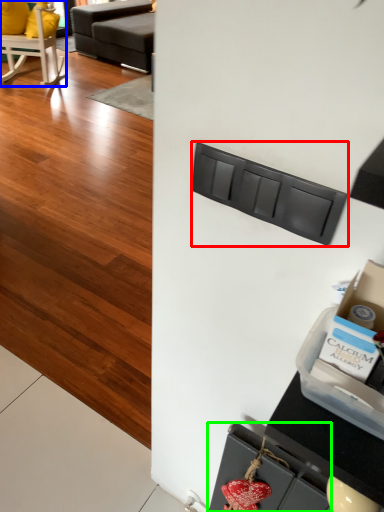
Question: Estimate the real-world distances between objects in this image. Which object is farther from drawer (highlighted by a red box), chair (highlighted by a blue box) or drawer (highlighted by a green box)?

Choices:
 (A) chair
 (B) drawer

Answer: (A)